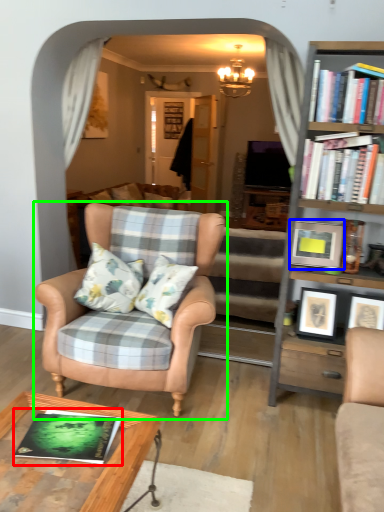
Question: Which object is the closest to the book (highlighted by a red box)? Choose among these: picture frame (highlighted by a blue box) or chair (highlighted by a green box).

Choices:
 (A) picture frame
 (B) chair

Answer: (B)